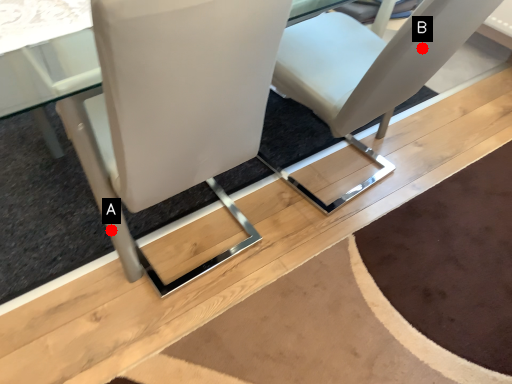
Question: Two points are circled on the image, labeled by A and B beside each circle. Which point appears farthest from the camera in this image?

Choices:
 (A) A is further
 (B) B is further

Answer: (A)